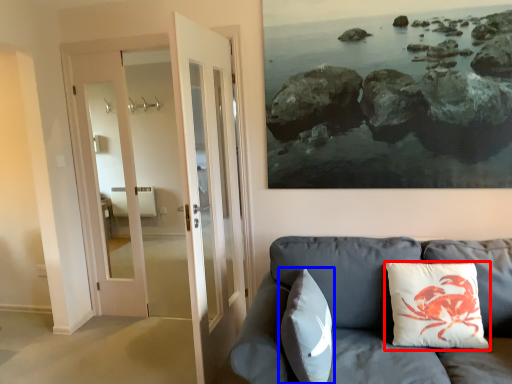
Question: Among these objects, which one is farthest to the camera, pillow (highlighted by a red box) or pillow (highlighted by a blue box)?

Choices:
 (A) pillow
 (B) pillow

Answer: (A)